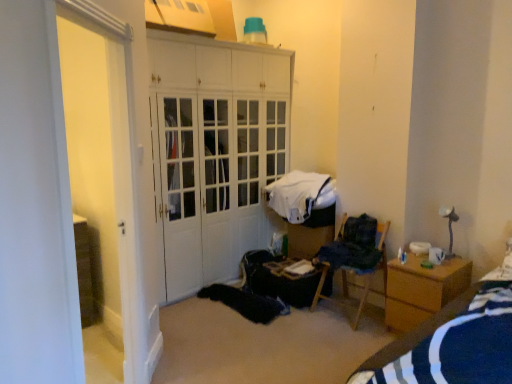
Find the location of a particular element. The height and width of the screenshot is (384, 512). free space in front of wooden table at center is located at coordinates (287, 329).